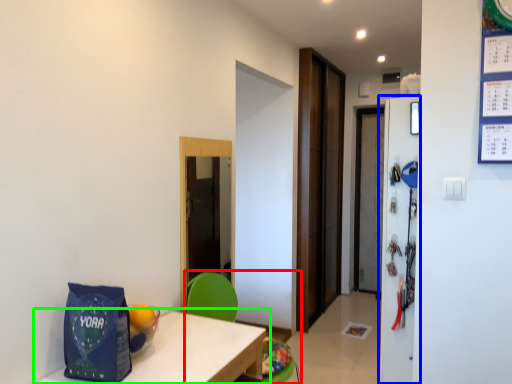
Question: Which object is positioned closest to armchair (highlighted by a red box)? Select from refrigerator (highlighted by a blue box) and table (highlighted by a green box).

Choices:
 (A) refrigerator
 (B) table

Answer: (B)